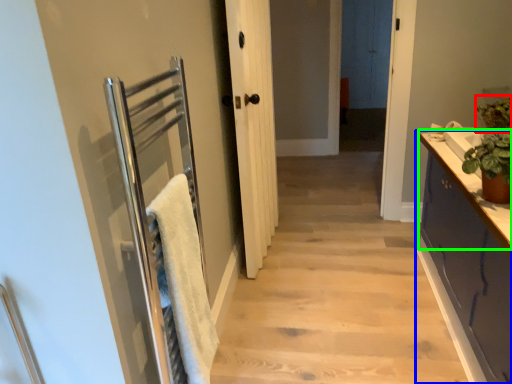
Question: Considering the real-world distances, which object is closest to plant (highlighted by a red box)? cabinetry (highlighted by a blue box) or counter top (highlighted by a green box).

Choices:
 (A) cabinetry
 (B) counter top

Answer: (B)